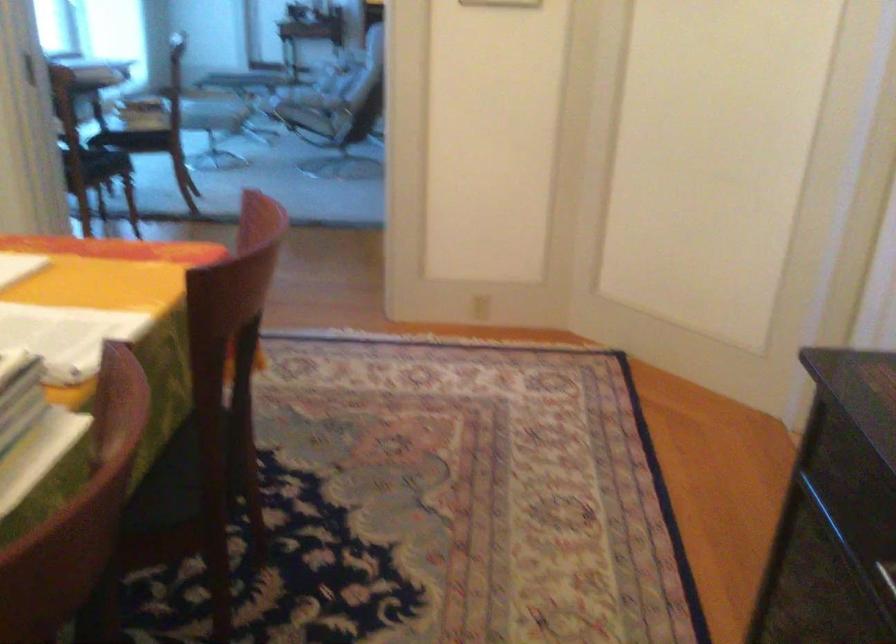
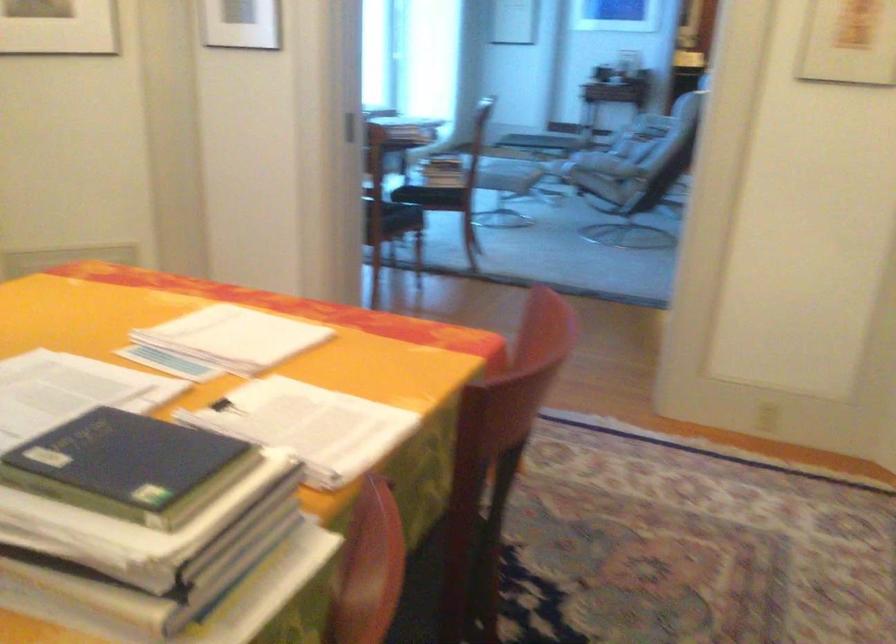
The point at (210, 460) is marked in the first image. Where is the corresponding point in the second image?

(452, 585)